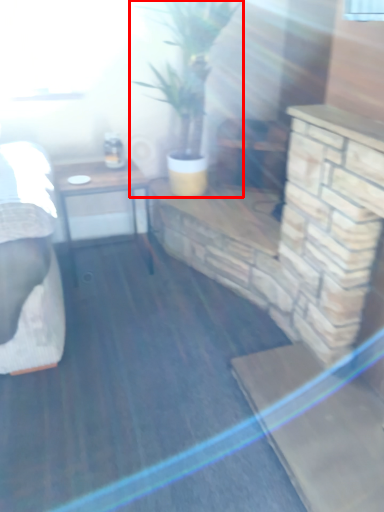
Question: From the image's perspective, what is the correct spatial positioning of houseplant (annotated by the red box) in reference to table?

Choices:
 (A) below
 (B) above

Answer: (B)